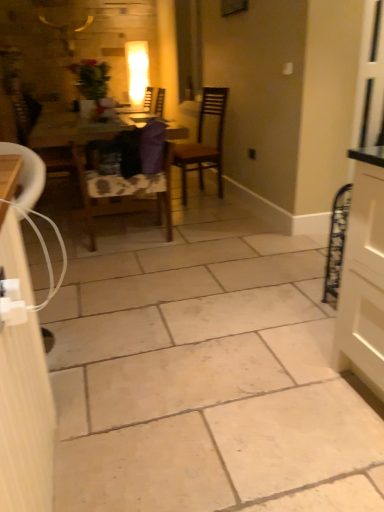
I want to click on vacant location behind white glossy cabinet at left, so click(x=91, y=306).